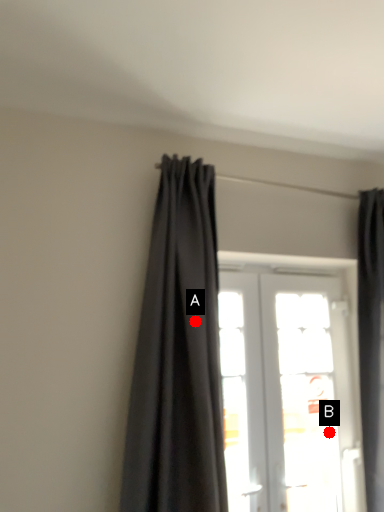
Question: Two points are circled on the image, labeled by A and B beside each circle. Which of the following is the farthest from the observer?

Choices:
 (A) A is further
 (B) B is further

Answer: (B)